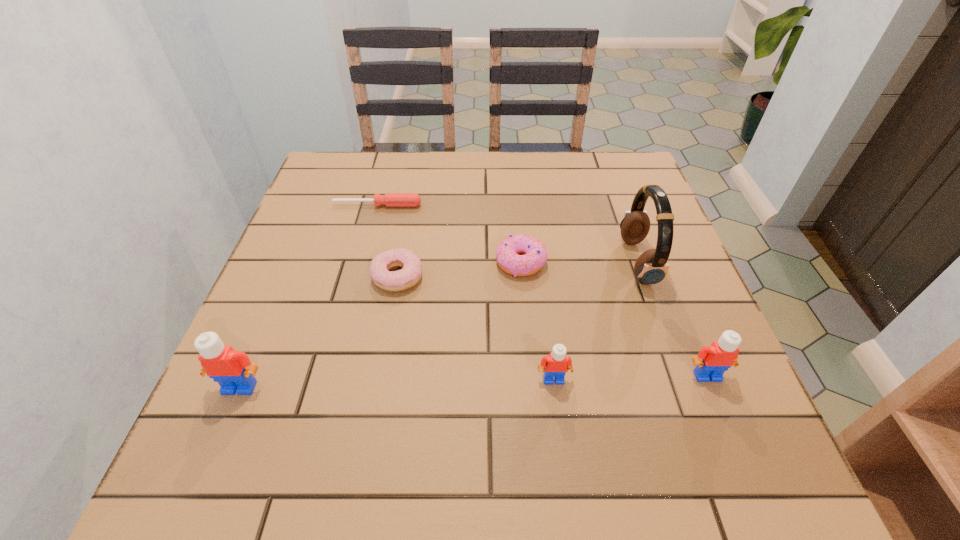
The height and width of the screenshot is (540, 960). In order to click on screwdriver that is at the left edge in this screenshot , I will do `click(389, 199)`.

Where is `Lego present at the right edge`? The width and height of the screenshot is (960, 540). Lego present at the right edge is located at coordinates (712, 361).

This screenshot has width=960, height=540. I want to click on headset located in the right edge section of the desktop, so click(651, 267).

This screenshot has width=960, height=540. Identify the location of object located in the near left corner section of the desktop. (234, 372).

This screenshot has height=540, width=960. What are the coordinates of `object that is at the near right corner` in the screenshot? It's located at (712, 361).

The image size is (960, 540). I want to click on free space at the far edge, so click(x=470, y=161).

I want to click on vacant point at the near edge, so click(x=329, y=391).

At what (x,y) coordinates should I click in order to perform the action: click on free space at the left edge. Please return your answer as a coordinate pair (x, y). This screenshot has height=540, width=960. Looking at the image, I should click on (302, 374).

Locate an element on the screen. This screenshot has width=960, height=540. vacant space at the right edge of the desktop is located at coordinates (606, 203).

Image resolution: width=960 pixels, height=540 pixels. Identify the location of blank space at the far left corner of the desktop. (355, 173).